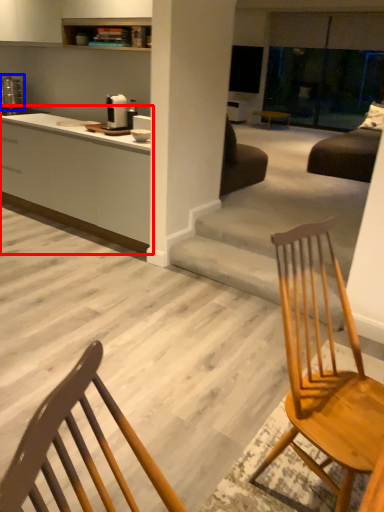
Question: Which point is closer to the camera, cabinetry (highlighted by a red box) or appliance (highlighted by a blue box)?

Choices:
 (A) cabinetry
 (B) appliance

Answer: (A)